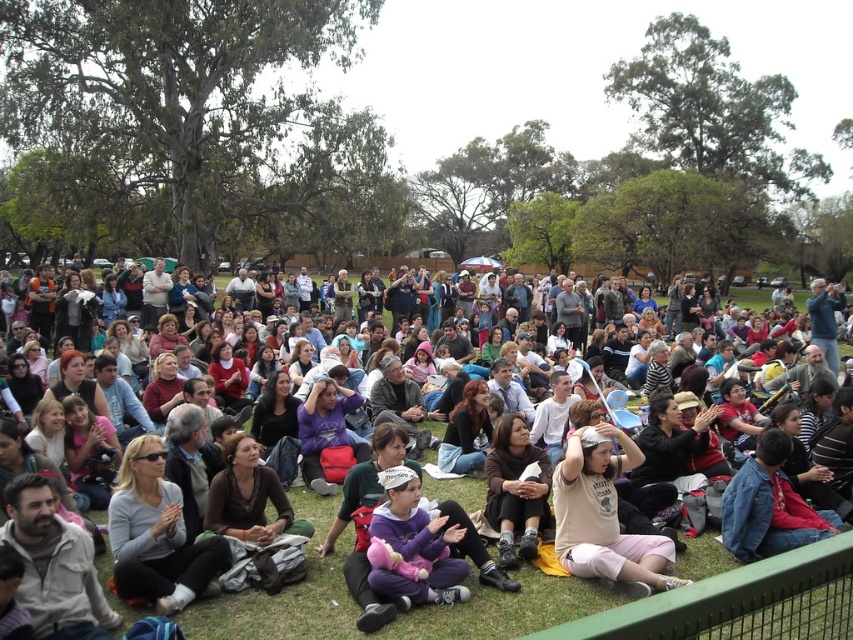
Is light pink cotton pants at center to the right of dark brown hair at center from the viewer's perspective?

Correct, you'll find light pink cotton pants at center to the right of dark brown hair at center.

Can you confirm if light pink cotton pants at center is thinner than dark brown hair at center?

In fact, light pink cotton pants at center might be wider than dark brown hair at center.

The image size is (853, 640). What do you see at coordinates (602, 513) in the screenshot?
I see `light pink cotton pants at center` at bounding box center [602, 513].

Where is `light pink cotton pants at center`? This screenshot has width=853, height=640. light pink cotton pants at center is located at coordinates (602, 513).

Who is taller, matte black sunglasses at center or dark brown hair at center?

matte black sunglasses at center

This screenshot has width=853, height=640. Describe the element at coordinates (155, 534) in the screenshot. I see `matte black sunglasses at center` at that location.

Where is `matte black sunglasses at center`? matte black sunglasses at center is located at coordinates (155, 534).

Between matte black jacket at center and light pink cotton pants at center, which one is positioned lower?

light pink cotton pants at center

Does matte black jacket at center appear under light pink cotton pants at center?

Incorrect, matte black jacket at center is not positioned below light pink cotton pants at center.

Is point (479, 634) farther from camera compared to point (663, 573)?

No, it is not.

Where is `matte black jacket at center`? matte black jacket at center is located at coordinates [x=397, y=616].